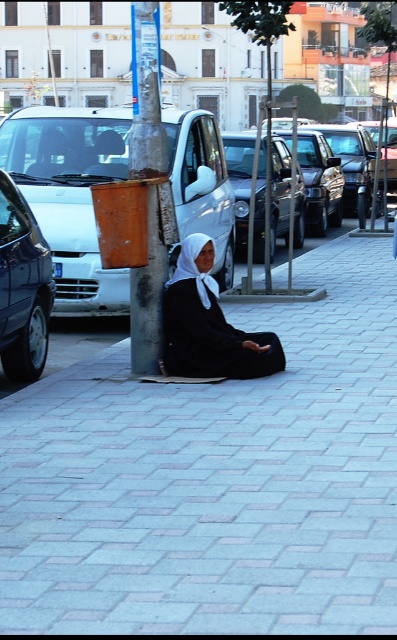
Which is behind, point (181, 248) or point (179, 252)?

Positioned behind is point (179, 252).

Between black matte dress at center and white fabric headscarf at center, which one has more height?

With more height is black matte dress at center.

Locate an element on the screen. The image size is (397, 640). black matte dress at center is located at coordinates (208, 324).

Is gray brick pavement at center bigger than rusty metal pole at center?

Actually, gray brick pavement at center might be smaller than rusty metal pole at center.

Who is shorter, gray brick pavement at center or rusty metal pole at center?

With less height is gray brick pavement at center.

Where is `gray brick pavement at center`? gray brick pavement at center is located at coordinates (215, 480).

Where is `gray brick pavement at center`? gray brick pavement at center is located at coordinates (215, 480).

Does rusty metal pole at center have a smaller size compared to shiny silver car at left?

Incorrect, rusty metal pole at center is not smaller in size than shiny silver car at left.

Based on the photo, which is more to the left, rusty metal pole at center or shiny silver car at left?

Positioned to the left is shiny silver car at left.

At what (x,y) coordinates should I click in order to perform the action: click on rusty metal pole at center. Please return your answer as a coordinate pair (x, y). Image resolution: width=397 pixels, height=640 pixels. Looking at the image, I should click on (146, 96).